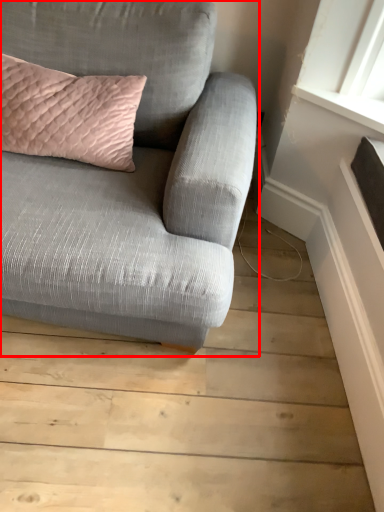
Question: In this image, where is studio couch (annotated by the red box) located relative to pillow?

Choices:
 (A) left
 (B) right

Answer: (B)